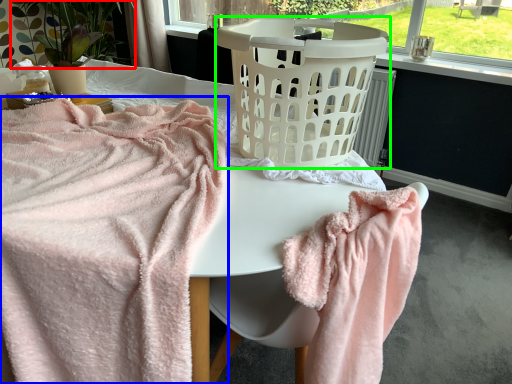
Question: Which object is the closest to the plant (highlighted by a red box)? Choose among these: towel (highlighted by a blue box) or basket container (highlighted by a green box).

Choices:
 (A) towel
 (B) basket container

Answer: (A)